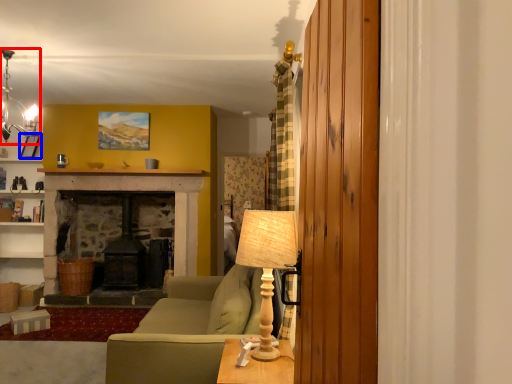
Question: Which object appears farthest to the camera in this image, lamp (highlighted by a red box) or picture frame (highlighted by a blue box)?

Choices:
 (A) lamp
 (B) picture frame

Answer: (B)